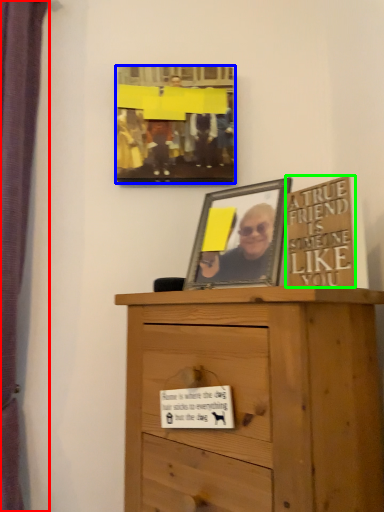
Question: Which object is the closest to the curtain (highlighted by a red box)? Choose among these: picture frame (highlighted by a blue box) or writing (highlighted by a green box).

Choices:
 (A) picture frame
 (B) writing

Answer: (A)